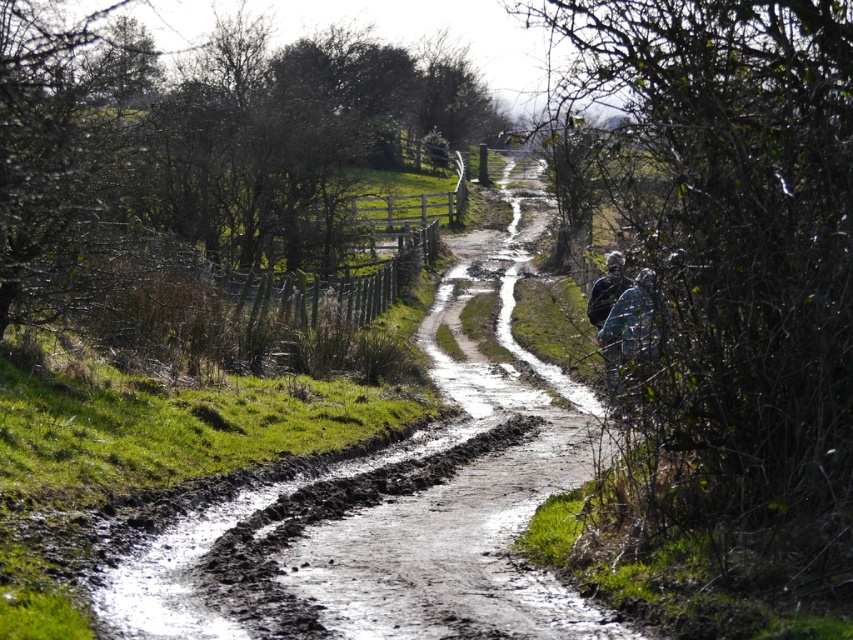
Between blue fabric at right and camouflage fabric backpack at right, which one is positioned lower?

Positioned lower is camouflage fabric backpack at right.

Based on the photo, which of these two, blue fabric at right or camouflage fabric backpack at right, stands shorter?

With less height is blue fabric at right.

Does point (656, 337) lie behind point (585, 307)?

No, (656, 337) is in front of (585, 307).

Find the location of a particular element. blue fabric at right is located at coordinates (631, 336).